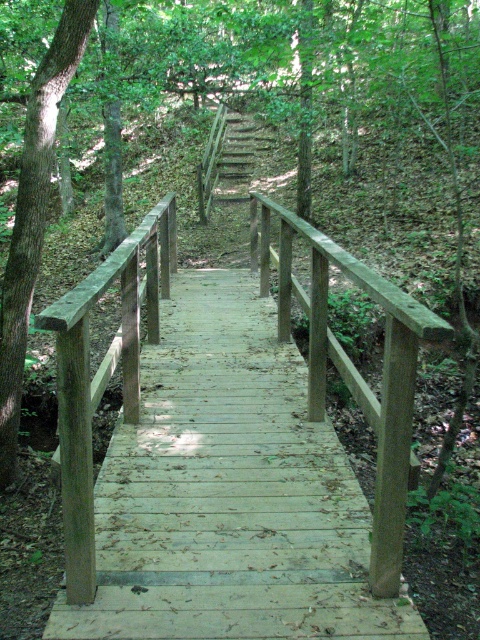
You are standing on the wooden walkway and want to climb the wooden stairs at center. Which direction should you face to see the light brown wooden rail at center next to the stairs?

The light brown wooden rail at center is to the right of the wooden stairs at center, so you should face to the right to see the rail next to the stairs.

You are a hiker standing on the wooden walkway and want to compare the height of the light brown wooden rail at center and the smooth brown tree trunk at left. Which one is taller?

The smooth brown tree trunk at left is taller than the light brown wooden rail at center.